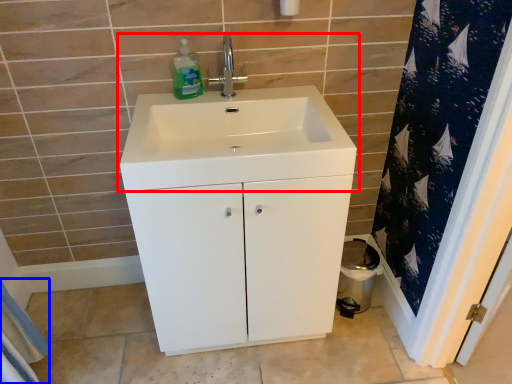
Question: Which object is closer to the camera taking this photo, sink (highlighted by a red box) or bath towel (highlighted by a blue box)?

Choices:
 (A) sink
 (B) bath towel

Answer: (A)